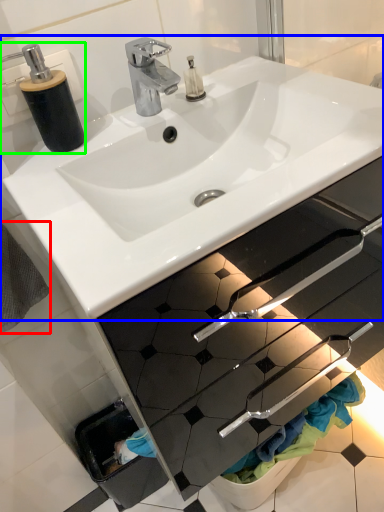
Question: Estimate the real-world distances between objects in this image. Which object is farther from bath towel (highlighted by a red box), sink (highlighted by a blue box) or soap dispenser (highlighted by a green box)?

Choices:
 (A) sink
 (B) soap dispenser

Answer: (A)